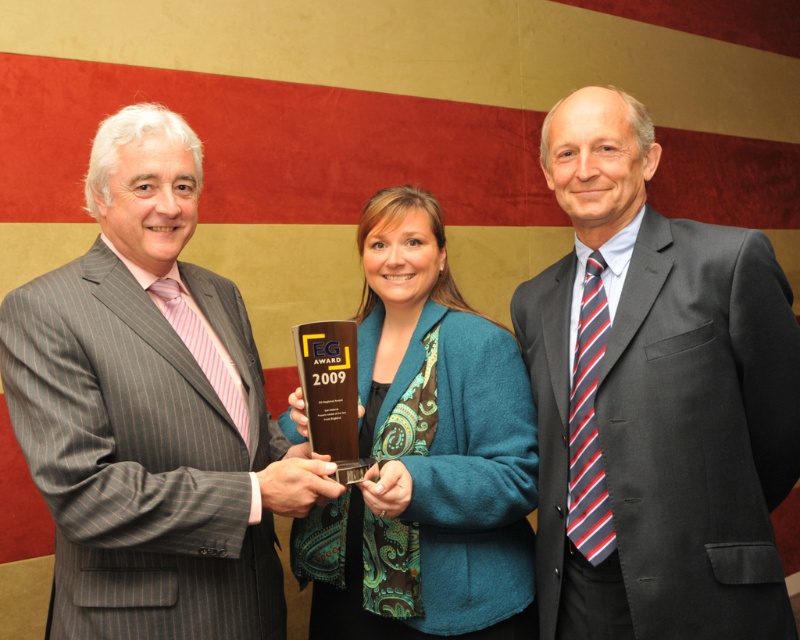
Where is `dark gray suit at right`? This screenshot has height=640, width=800. dark gray suit at right is located at coordinates (654, 400).

Does point (713, 589) come closer to viewer compared to point (504, 355)?

Yes.

The width and height of the screenshot is (800, 640). What are the coordinates of `dark gray suit at right` in the screenshot? It's located at (654, 400).

Does gray pinstripe suit at center have a greater width compared to teal fabric jacket at center?

Indeed, gray pinstripe suit at center has a greater width compared to teal fabric jacket at center.

Consider the image. Between gray pinstripe suit at center and teal fabric jacket at center, which one is positioned lower?

teal fabric jacket at center

Describe the element at coordinates (152, 412) in the screenshot. I see `gray pinstripe suit at center` at that location.

This screenshot has width=800, height=640. What are the coordinates of `gray pinstripe suit at center` in the screenshot? It's located at (152, 412).

Who is more forward, (560,580) or (210,378)?

Point (210,378) is more forward.

In the scene shown: Is the position of dark gray suit at right less distant than that of gray pinstripe suit at center?

That is False.

You are a GUI agent. You are given a task and a screenshot of the screen. Output one action in this format:
    pyautogui.click(x=<x>, y=<y>)
    Task: Click on the dark gray suit at right
    Image resolution: width=800 pixels, height=640 pixels.
    Given the screenshot: What is the action you would take?
    pyautogui.click(x=654, y=400)